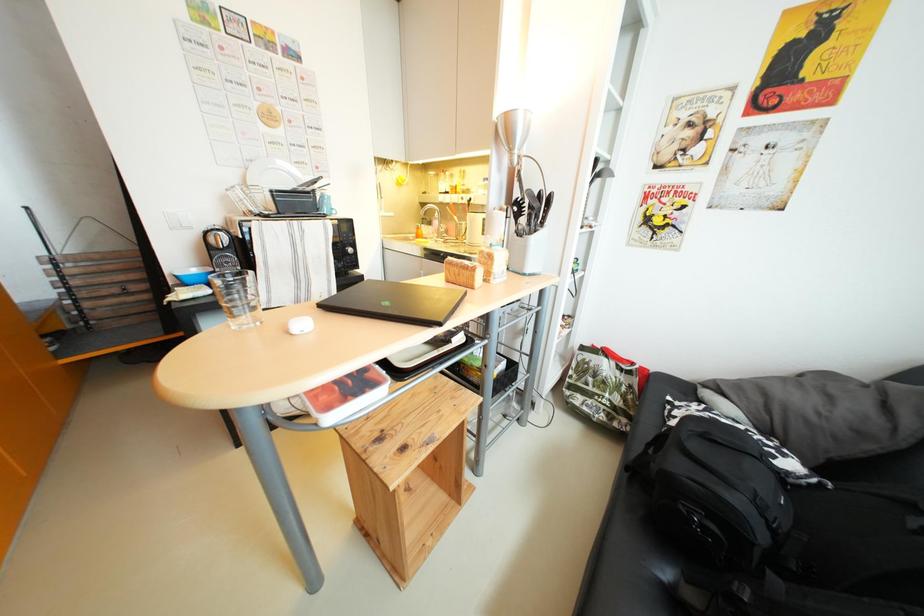
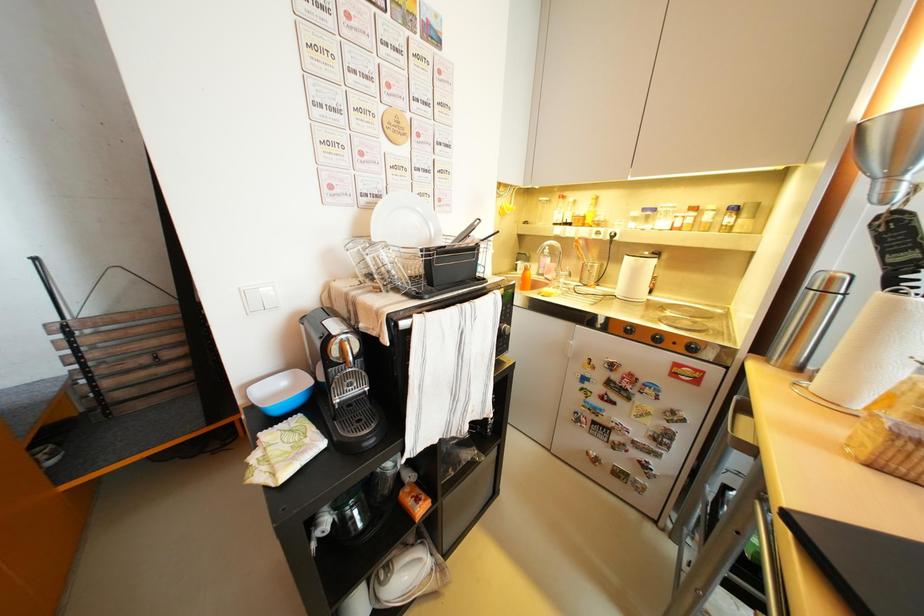
Which direction would the cameraman need to move to produce the second image?

The cameraman walked toward left, forward.